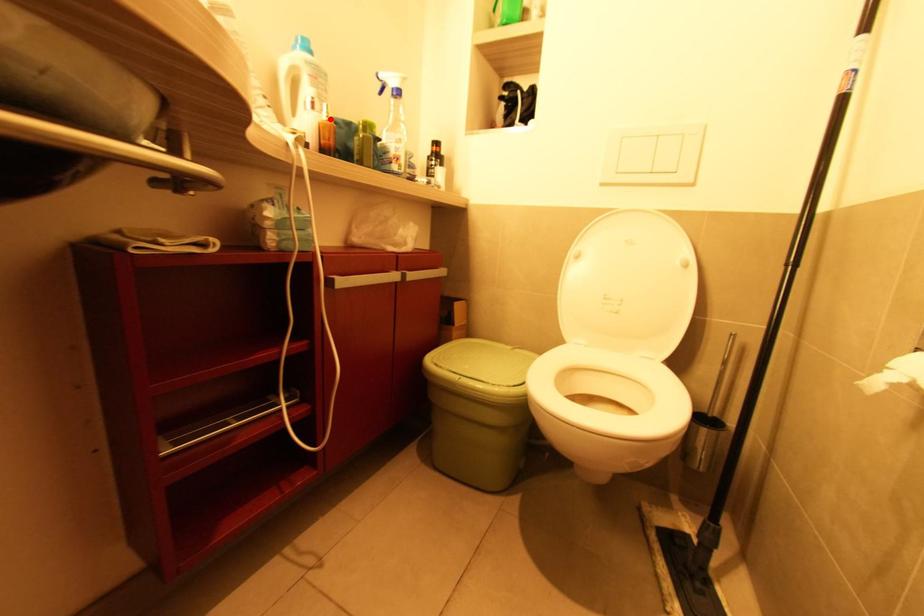
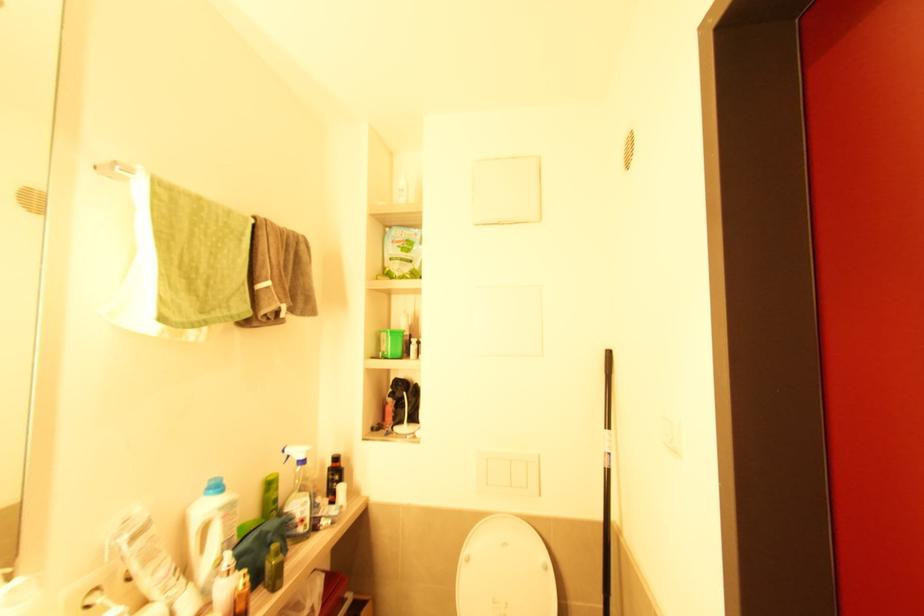
In the second image, find the point that corresponds to the highlighted location in the first image.

(247, 585)